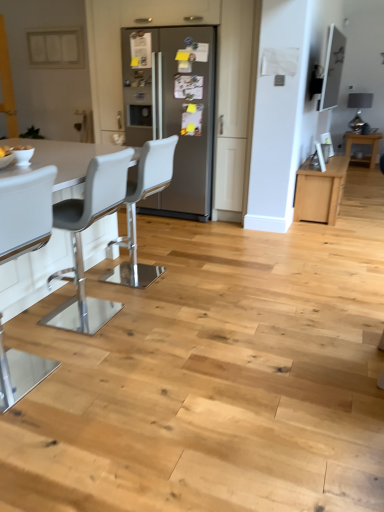
Find the location of a particular element. vacant region below white plastic chair at center, positioned as the third chair in front-to-back order (from a real-world perspective) is located at coordinates (142, 279).